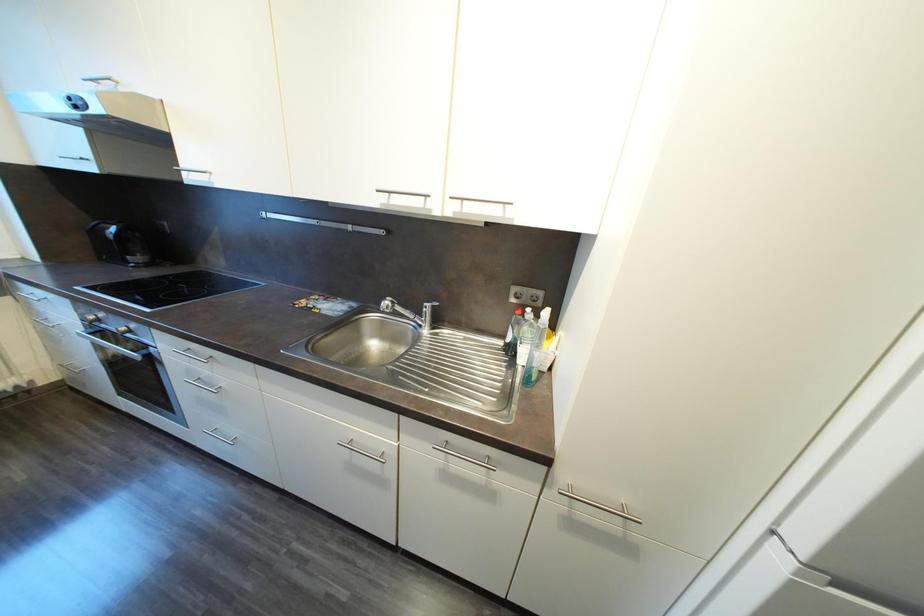
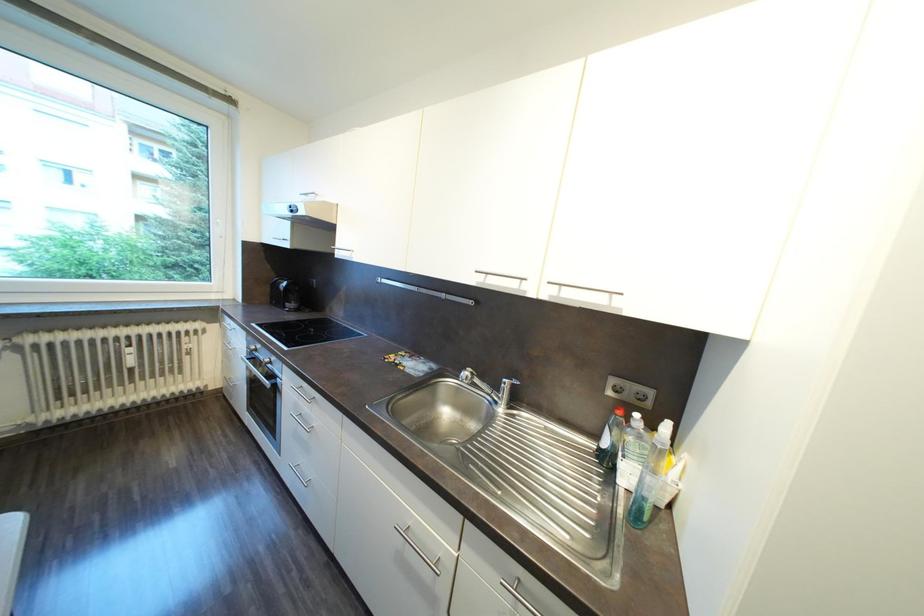
Question: Which direction would the cameraman need to move to produce the second image? Reply with the corresponding letter.

Choices:
 (A) Left
 (B) Right
 (C) Forward
 (D) Backward

Answer: (A)